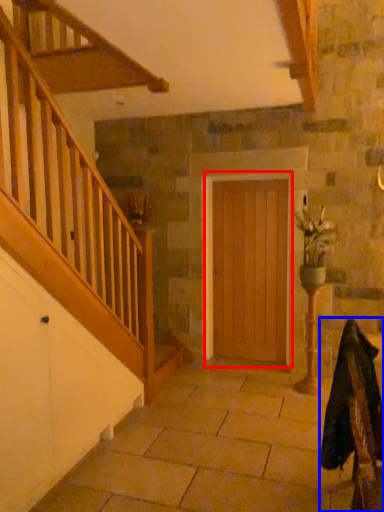
Question: Which object is further to the camera taking this photo, door (highlighted by a red box) or rocking chair (highlighted by a blue box)?

Choices:
 (A) door
 (B) rocking chair

Answer: (A)